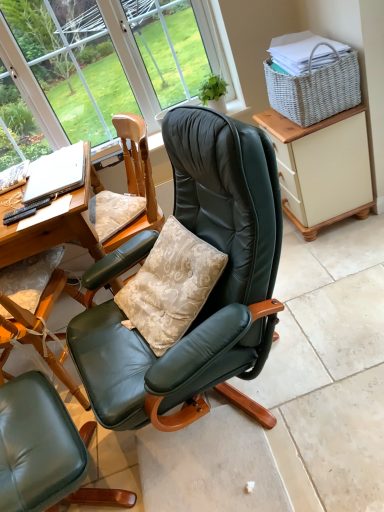
Question: Does silver metallic laptop at left lie behind black plastic remote control at lower left?

Choices:
 (A) yes
 (B) no

Answer: (A)

Question: Does silver metallic laptop at left have a smaller size compared to black plastic remote control at lower left?

Choices:
 (A) yes
 (B) no

Answer: (B)

Question: Is silver metallic laptop at left placed right next to black plastic remote control at lower left?

Choices:
 (A) yes
 (B) no

Answer: (B)

Question: Is silver metallic laptop at left wider than black plastic remote control at lower left?

Choices:
 (A) yes
 (B) no

Answer: (A)

Question: From a real-world perspective, is silver metallic laptop at left on top of black plastic remote control at lower left?

Choices:
 (A) yes
 (B) no

Answer: (A)

Question: In terms of width, does matte glass window at upper center look wider or thinner when compared to white woven picnic basket at upper right?

Choices:
 (A) thin
 (B) wide

Answer: (A)

Question: In the image, is matte glass window at upper center on the left side or the right side of white woven picnic basket at upper right?

Choices:
 (A) left
 (B) right

Answer: (A)

Question: From a real-world perspective, relative to white woven picnic basket at upper right, is matte glass window at upper center vertically above or below?

Choices:
 (A) above
 (B) below

Answer: (A)

Question: Is point (6, 27) positioned closer to the camera than point (350, 94)?

Choices:
 (A) closer
 (B) farther

Answer: (B)

Question: In the image, is silver metallic laptop at left on the left side or the right side of matte green leather chair at center?

Choices:
 (A) right
 (B) left

Answer: (B)

Question: Does point (72, 183) appear closer or farther from the camera than point (87, 489)?

Choices:
 (A) farther
 (B) closer

Answer: (A)

Question: Is silver metallic laptop at left taller or shorter than matte green leather chair at center?

Choices:
 (A) tall
 (B) short

Answer: (B)

Question: From a real-world perspective, is silver metallic laptop at left physically located above or below matte green leather chair at center?

Choices:
 (A) below
 (B) above

Answer: (B)

Question: From the image's perspective, is beige painted cabinet at right above or below black plastic remote control at lower left?

Choices:
 (A) above
 (B) below

Answer: (A)

Question: Is beige painted cabinet at right wider or thinner than black plastic remote control at lower left?

Choices:
 (A) thin
 (B) wide

Answer: (B)